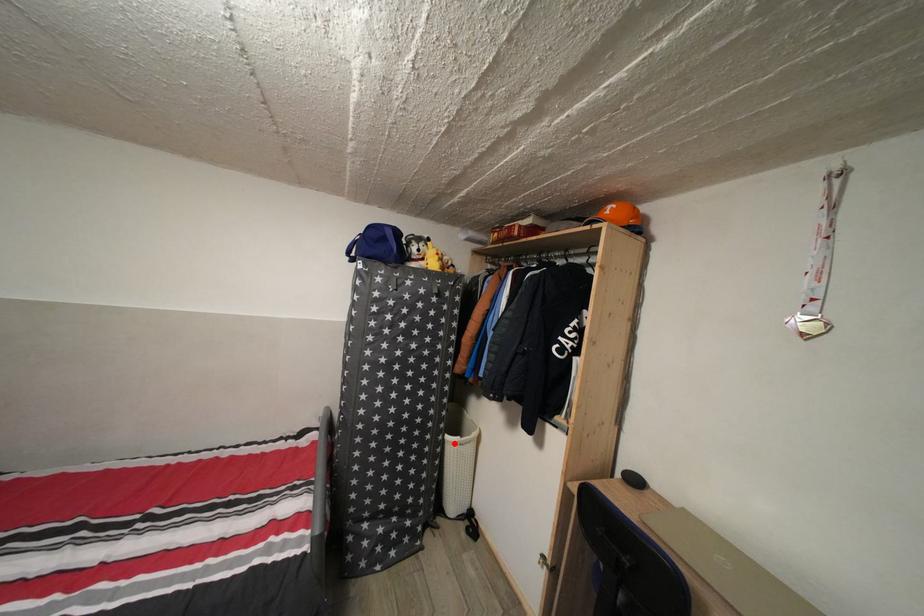
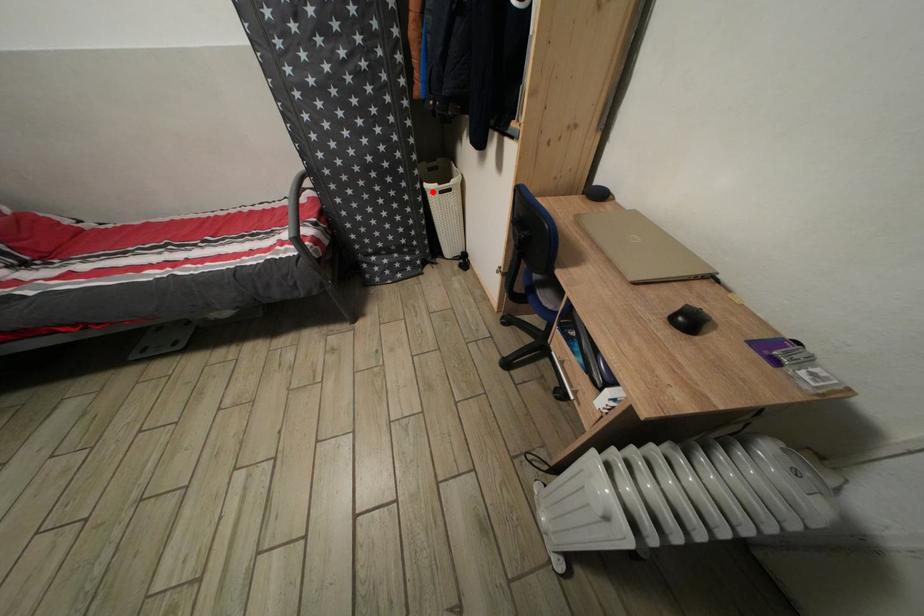
I am providing you with two images of the same scene from different viewpoints. A red point is marked on the first image and another point is marked on the second image. Do the highlighted points in image1 and image2 indicate the same real-world spot?

Yes